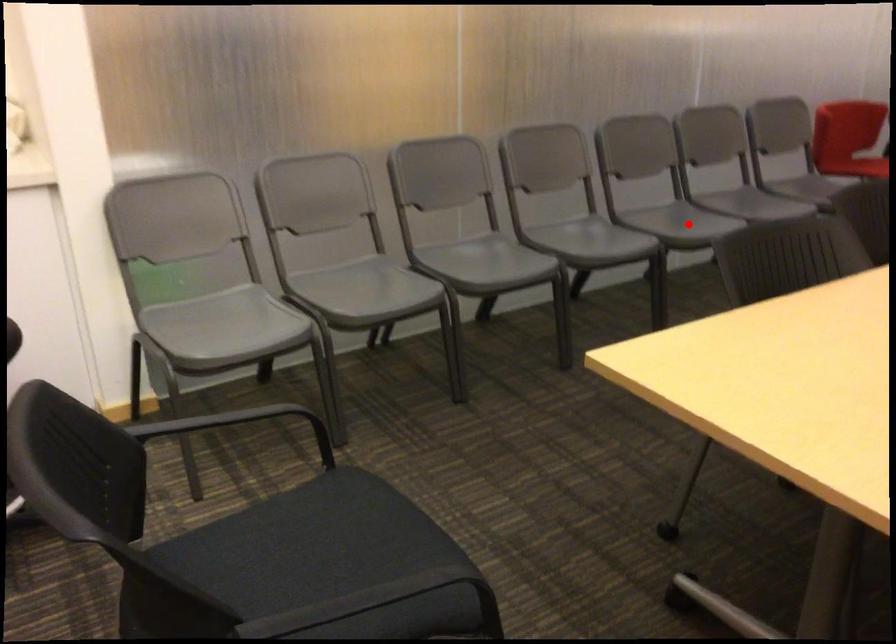
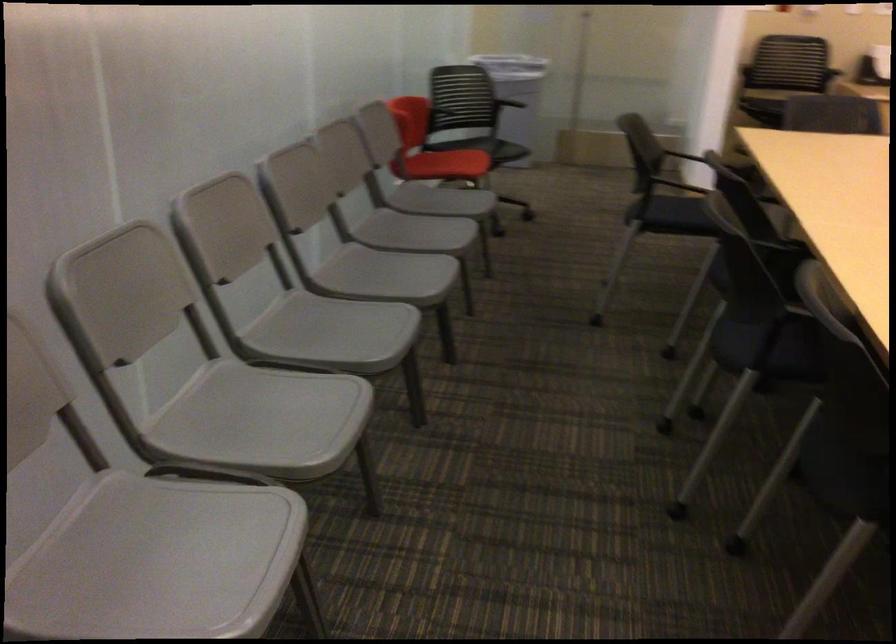
In the second image, find the point that corresponds to the highlighted location in the first image.

(385, 275)